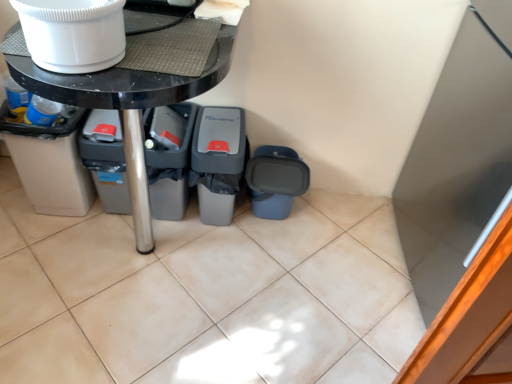
Image resolution: width=512 pixels, height=384 pixels. Find the location of `free area in between black glossy table at center and white glossy refrigerator at upper right`. free area in between black glossy table at center and white glossy refrigerator at upper right is located at coordinates (318, 268).